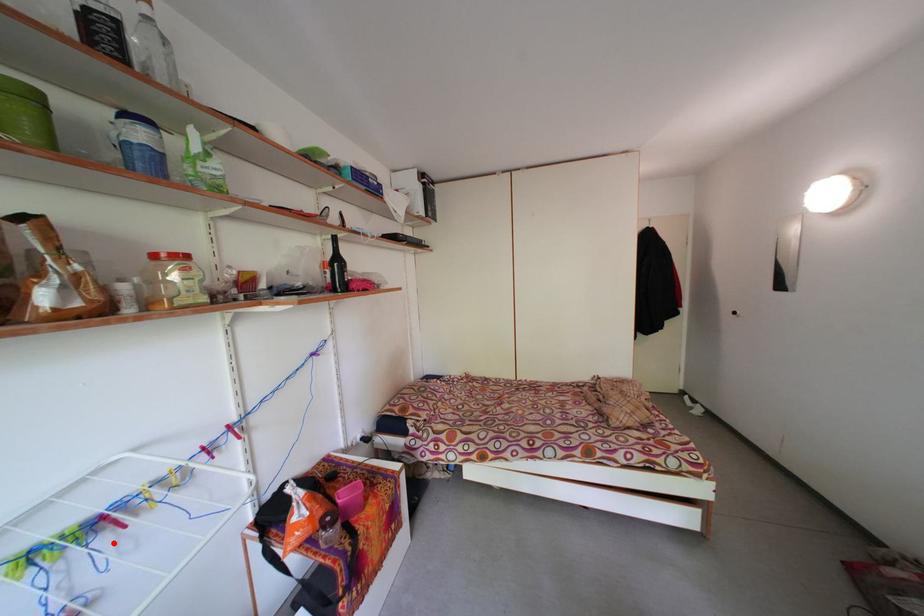
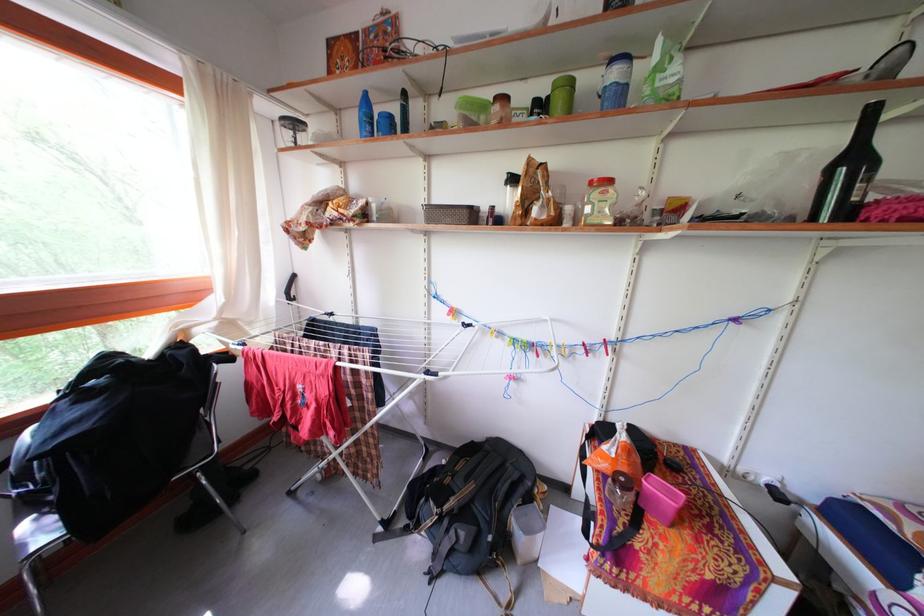
Locate, in the second image, the point that corresponds to the highlighted location in the first image.

(540, 361)